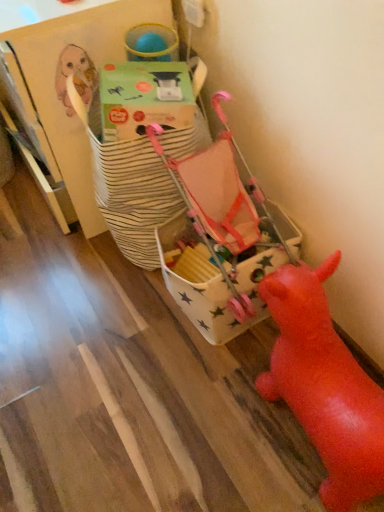
What do you see at coordinates (220, 232) in the screenshot?
I see `white star-patterned fabric bag at center, the 1th toy from the back` at bounding box center [220, 232].

How much space does rubber red pig at lower right, acting as the second toy starting from the back, occupy horizontally?

11.94 inches.

This screenshot has height=512, width=384. Find the location of `rubber red pig at lower right, acting as the second toy starting from the back`. rubber red pig at lower right, acting as the second toy starting from the back is located at coordinates (324, 385).

Where is `green cardboard box at upper center`? The image size is (384, 512). green cardboard box at upper center is located at coordinates (145, 98).

Does green cardboard box at upper center have a greater height compared to rubber red pig at lower right, the 1th toy in the front-to-back sequence?

No.

Is green cardboard box at upper center completely or partially outside of rubber red pig at lower right, the 1th toy in the front-to-back sequence?

Yes, green cardboard box at upper center is located beyond the bounds of rubber red pig at lower right, the 1th toy in the front-to-back sequence.

Which is behind, point (171, 71) or point (364, 410)?

The point (171, 71) is farther.

From the picture: From a real-world perspective, who is located higher, green cardboard box at upper center or rubber red pig at lower right, acting as the second toy starting from the back?

green cardboard box at upper center.

Would you say white star-patterned fabric bag at center, the 1th toy from the back, is inside or outside green cardboard box at upper center?

white star-patterned fabric bag at center, the 1th toy from the back, lies outside green cardboard box at upper center.

From the picture: Which is in front, white star-patterned fabric bag at center, the 1th toy from the back, or green cardboard box at upper center?

green cardboard box at upper center is closer to the camera.

From the picture: Is rubber red pig at lower right, acting as the second toy starting from the back, bigger or smaller than white star-patterned fabric bag at center, the 1th toy from the back?

In the image, rubber red pig at lower right, acting as the second toy starting from the back, appears to be larger than white star-patterned fabric bag at center, the 1th toy from the back.

In the image, is rubber red pig at lower right, the 1th toy in the front-to-back sequence, on the left side or the right side of white star-patterned fabric bag at center, which is the second toy in front-to-back order?

Based on their positions, rubber red pig at lower right, the 1th toy in the front-to-back sequence, is located to the right of white star-patterned fabric bag at center, which is the second toy in front-to-back order.

Image resolution: width=384 pixels, height=512 pixels. Find the location of `toy on the right side of white star-patterned fabric bag at center, which is the second toy in front-to-back order`. toy on the right side of white star-patterned fabric bag at center, which is the second toy in front-to-back order is located at coordinates (324, 385).

In the scene shown: Which is nearer, [355,415] or [123,116]?

Positioned in front is point [355,415].

Which object is wider, rubber red pig at lower right, the 1th toy in the front-to-back sequence, or green cardboard box at upper center?

rubber red pig at lower right, the 1th toy in the front-to-back sequence, is wider.

How different are the orientations of rubber red pig at lower right, the 1th toy in the front-to-back sequence, and green cardboard box at upper center in degrees?

The angle between the facing direction of rubber red pig at lower right, the 1th toy in the front-to-back sequence, and the facing direction of green cardboard box at upper center is 25.6 degrees.

In the scene shown: Is rubber red pig at lower right, acting as the second toy starting from the back, completely or partially outside of green cardboard box at upper center?

Yes, rubber red pig at lower right, acting as the second toy starting from the back, is outside of green cardboard box at upper center.

Choose the correct answer: Is green cardboard box at upper center inside white star-patterned fabric bag at center, the 1th toy from the back, or outside it?

green cardboard box at upper center is not enclosed by white star-patterned fabric bag at center, the 1th toy from the back.

Considering the positions of point (130, 70) and point (220, 219), is point (130, 70) closer or farther from the camera than point (220, 219)?

Point (130, 70).

From a real-world perspective, relative to white star-patterned fabric bag at center, the 1th toy from the back, is green cardboard box at upper center vertically above or below?

In terms of real-world spatial position, green cardboard box at upper center is above white star-patterned fabric bag at center, the 1th toy from the back.

Does green cardboard box at upper center come in front of white star-patterned fabric bag at center, which is the second toy in front-to-back order?

Yes.

Which is closer to the camera, (x=187, y=190) or (x=334, y=268)?

Point (x=334, y=268)

How different are the orientations of white star-patterned fabric bag at center, the 1th toy from the back, and rubber red pig at lower right, acting as the second toy starting from the back, in degrees?

There is a 0.00021-degree angle between the facing directions of white star-patterned fabric bag at center, the 1th toy from the back, and rubber red pig at lower right, acting as the second toy starting from the back.

Image resolution: width=384 pixels, height=512 pixels. I want to click on toy in front of the white star-patterned fabric bag at center, which is the second toy in front-to-back order, so click(x=324, y=385).

From the image's perspective, is white star-patterned fabric bag at center, which is the second toy in front-to-back order, positioned above or below rubber red pig at lower right, the 1th toy in the front-to-back sequence?

white star-patterned fabric bag at center, which is the second toy in front-to-back order, is situated higher than rubber red pig at lower right, the 1th toy in the front-to-back sequence, in the image.

From a real-world perspective, count 1st toys downward from the green cardboard box at upper center and point to it. Please provide its 2D coordinates.

[(324, 385)]

What are the coordinates of `toy behind the green cardboard box at upper center` in the screenshot? It's located at click(x=220, y=232).

From the image, which object appears to be nearer to rubber red pig at lower right, acting as the second toy starting from the back, white star-patterned fabric bag at center, which is the second toy in front-to-back order, or green cardboard box at upper center?

white star-patterned fabric bag at center, which is the second toy in front-to-back order, lies closer to rubber red pig at lower right, acting as the second toy starting from the back, than the other object.

Looking at the image, which one is located further to green cardboard box at upper center, rubber red pig at lower right, acting as the second toy starting from the back, or white star-patterned fabric bag at center, the 1th toy from the back?

Among the two, rubber red pig at lower right, acting as the second toy starting from the back, is located further to green cardboard box at upper center.

Based on their spatial positions, is rubber red pig at lower right, the 1th toy in the front-to-back sequence, or green cardboard box at upper center further from white star-patterned fabric bag at center, the 1th toy from the back?

The object further to white star-patterned fabric bag at center, the 1th toy from the back, is rubber red pig at lower right, the 1th toy in the front-to-back sequence.

Based on their spatial positions, is green cardboard box at upper center or rubber red pig at lower right, the 1th toy in the front-to-back sequence, further from white star-patterned fabric bag at center, which is the second toy in front-to-back order?

rubber red pig at lower right, the 1th toy in the front-to-back sequence, is positioned further to the anchor white star-patterned fabric bag at center, which is the second toy in front-to-back order.

Looking at the image, which one is located further to rubber red pig at lower right, the 1th toy in the front-to-back sequence, green cardboard box at upper center or white star-patterned fabric bag at center, the 1th toy from the back?

green cardboard box at upper center is further to rubber red pig at lower right, the 1th toy in the front-to-back sequence.

Estimate the real-world distances between objects in this image. Which object is further from green cardboard box at upper center, white star-patterned fabric bag at center, the 1th toy from the back, or rubber red pig at lower right, the 1th toy in the front-to-back sequence?

Based on the image, rubber red pig at lower right, the 1th toy in the front-to-back sequence, appears to be further to green cardboard box at upper center.

Locate an element on the screen. toy between green cardboard box at upper center and rubber red pig at lower right, the 1th toy in the front-to-back sequence, in the up-down direction is located at coordinates (220, 232).